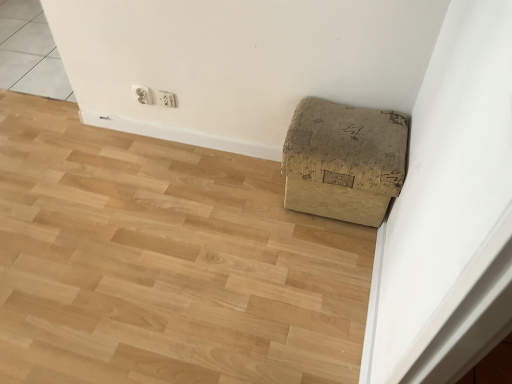
Question: Based on their sizes in the image, would you say white plastic electric outlet at upper center, the first electric outlet in the right-to-left sequence, is bigger or smaller than brown cardboard box at lower right?

Choices:
 (A) big
 (B) small

Answer: (B)

Question: Is white plastic electric outlet at upper center, the 2th electric outlet from the left, taller or shorter than brown cardboard box at lower right?

Choices:
 (A) tall
 (B) short

Answer: (B)

Question: Which object is positioned farthest from the brown cardboard box at lower right?

Choices:
 (A) brown cardboard box at lower right
 (B) white plastic electric outlet at upper center, the first electric outlet in the right-to-left sequence
 (C) white plastic electric outlet at upper center, positioned as the 2th electric outlet in right-to-left order

Answer: (C)

Question: Estimate the real-world distances between objects in this image. Which object is closer to the brown cardboard box at lower right?

Choices:
 (A) white plastic electric outlet at upper center, positioned as the 2th electric outlet in right-to-left order
 (B) white plastic electric outlet at upper center, the first electric outlet in the right-to-left sequence
 (C) brown cardboard box at lower right

Answer: (C)